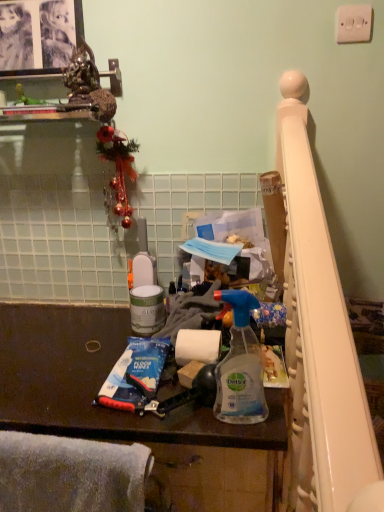
Question: Considering the positions of white soft towel at lower left and blue plastic toothpaste at lower center in the image, is white soft towel at lower left wider or thinner than blue plastic toothpaste at lower center?

Choices:
 (A) thin
 (B) wide

Answer: (A)

Question: From a real-world perspective, is white soft towel at lower left positioned above or below blue plastic toothpaste at lower center?

Choices:
 (A) above
 (B) below

Answer: (B)

Question: Which object is the farthest from the blue plastic toothpaste at lower center?

Choices:
 (A) white glossy paint can at center
 (B) black glossy picture frame at upper left
 (C) dark brown laminate counter at center
 (D) transparent plastic spray bottle at center
 (E) white plastic light switch at upper right

Answer: (E)

Question: Considering the real-world distances, which object is farthest from the transparent plastic spray bottle at center?

Choices:
 (A) blue plastic toothpaste at lower center
 (B) white soft towel at lower left
 (C) dark brown laminate counter at center
 (D) white glossy paint can at center
 (E) black glossy picture frame at upper left

Answer: (E)